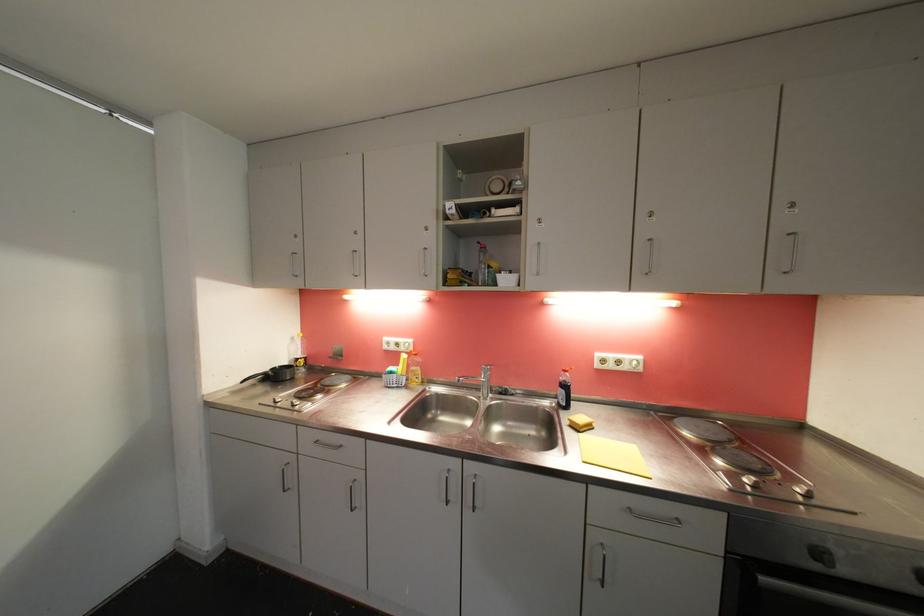
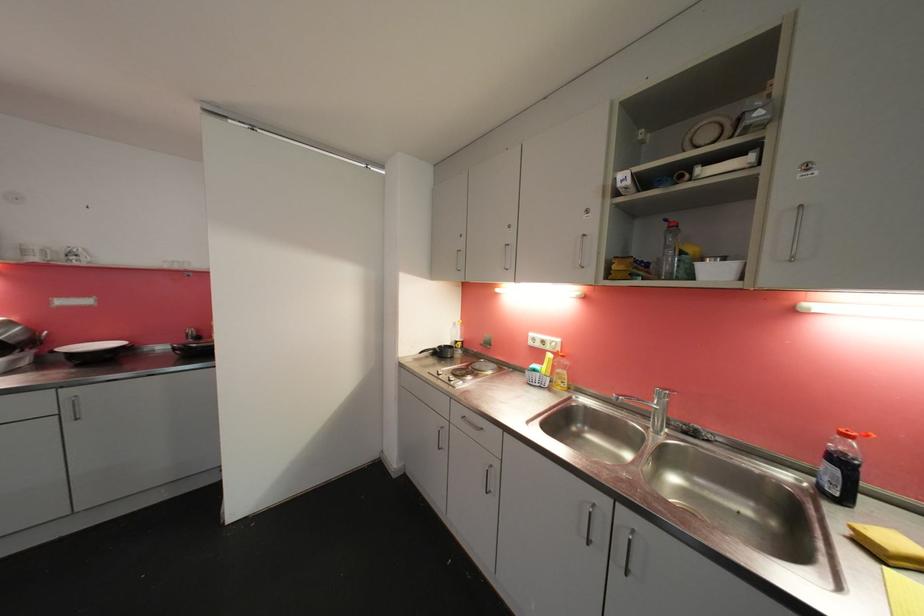
The point at [483,245] is marked in the first image. Where is the corresponding point in the second image?

(671, 223)